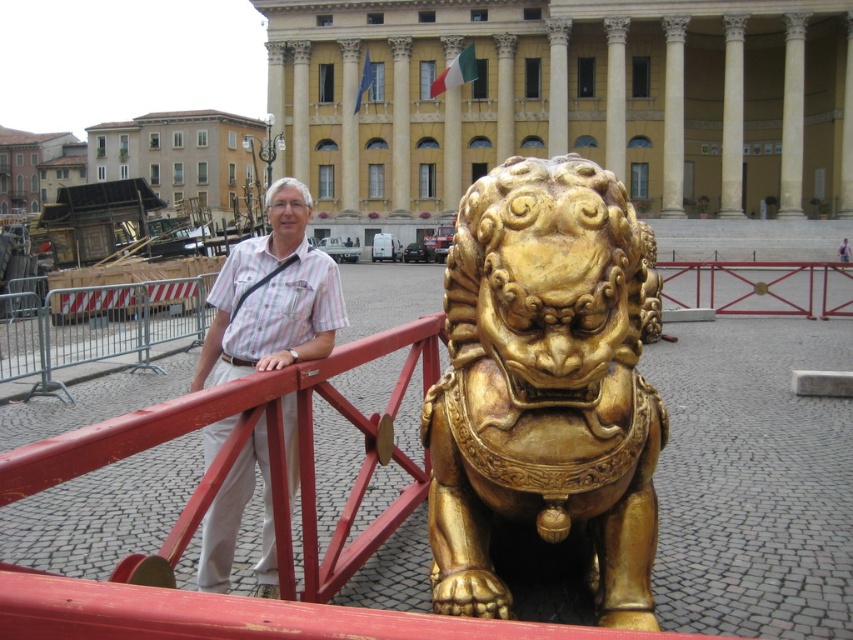
You are a photographer trying to capture the man in the white striped shirt at center and the gold polished lion at center in the same frame. Based on their positions, will the lion block the view of the man?

The gold polished lion at center is in front of the white striped shirt at center, so the lion will block the view of the man in the white striped shirt at center.

You are a photographer trying to capture both the gold polished lion at center and the white striped shirt at center in a single frame. Which object should you focus on first to ensure both are in the frame?

The gold polished lion at center is larger in size than the white striped shirt at center, so you should focus on the gold polished lion at center first to ensure both are in the frame.

You are a tour guide explaining the layout of the square to a visitor. Pointing to the gold polished lion at center and the metallic silver fence at left, you want to describe their positions relative to each other. How would you phrase this?

The gold polished lion at center is positioned on the right side of the metallic silver fence at left.